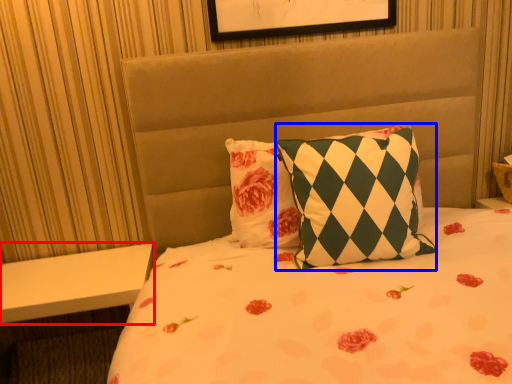
Question: Which object appears farthest to the camera in this image, table (highlighted by a red box) or pillow (highlighted by a blue box)?

Choices:
 (A) table
 (B) pillow

Answer: (A)